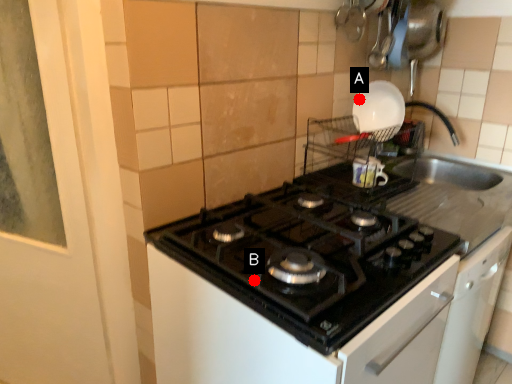
Question: Two points are circled on the image, labeled by A and B beside each circle. Which point is farther to the camera?

Choices:
 (A) A is further
 (B) B is further

Answer: (A)